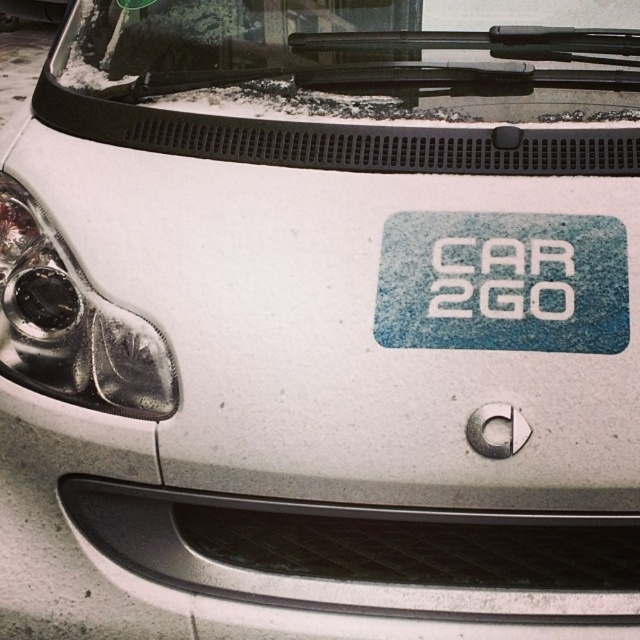
You are a delivery person trying to place a package on the hood of the car. The package is 1 meter long. You see the transparent glass windshield at upper center and the blue textured sticker at center. Can you fit the package horizontally between these two objects?

The transparent glass windshield at upper center is further to the viewer than blue textured sticker at center, so the distance between them is not sufficient to fit a 1 meter long package horizontally.

You are a driver approaching the car and need to read the text on the blue textured sticker at center. Can you see the text clearly through the transparent glass windshield at upper center?

The transparent glass windshield at upper center is positioned on the left side of blue textured sticker at center, so the windshield is not directly in front of the sticker. Therefore, you can see the text on the blue textured sticker at center clearly without obstruction.